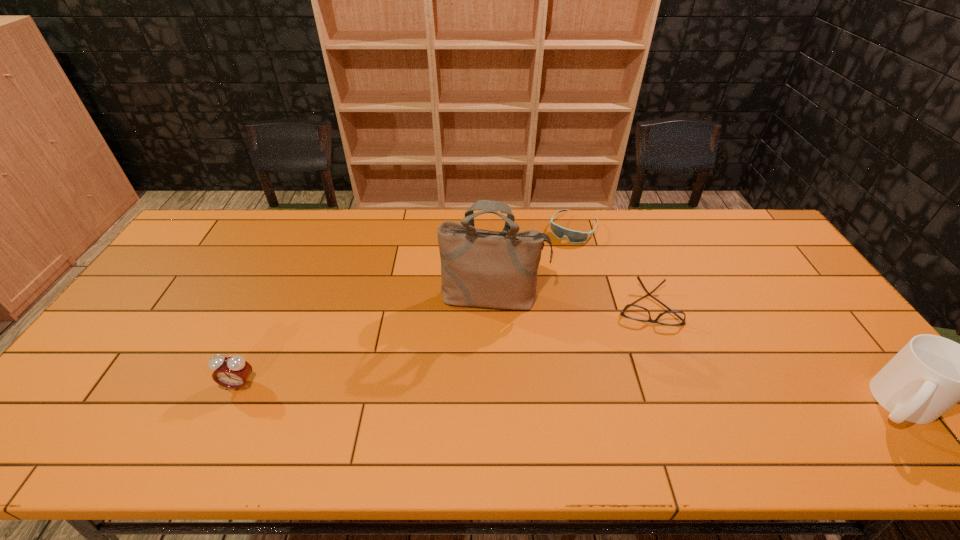
You are a GUI agent. You are given a task and a screenshot of the screen. Output one action in this format:
    pyautogui.click(x=<x>, y=<y>)
    Task: Click on the vacant space positioned on the front-facing side of the tallest object
    This screenshot has width=960, height=540.
    Given the screenshot: What is the action you would take?
    pyautogui.click(x=486, y=414)

Image resolution: width=960 pixels, height=540 pixels. I want to click on vacant region located on the front-facing side of the tallest object, so click(x=490, y=340).

You are a GUI agent. You are given a task and a screenshot of the screen. Output one action in this format:
    pyautogui.click(x=<x>, y=<y>)
    Task: Click on the vacant space located 0.070m on the front-facing side of the spectacles
    The image size is (960, 540).
    Given the screenshot: What is the action you would take?
    pyautogui.click(x=648, y=345)

Where is `free space located on the front-facing side of the spectacles`? The height and width of the screenshot is (540, 960). free space located on the front-facing side of the spectacles is located at coordinates (651, 389).

Locate an element on the screen. This screenshot has width=960, height=540. free location located on the front-facing side of the spectacles is located at coordinates (651, 386).

The image size is (960, 540). I want to click on object that is at the far edge, so click(573, 236).

You are a GUI agent. You are given a task and a screenshot of the screen. Output one action in this format:
    pyautogui.click(x=<x>, y=<y>)
    Task: Click on the object that is at the near edge
    The image size is (960, 540).
    Given the screenshot: What is the action you would take?
    pyautogui.click(x=233, y=372)

You are a GUI agent. You are given a task and a screenshot of the screen. Output one action in this format:
    pyautogui.click(x=<x>, y=<y>)
    Task: Click on the vacant space at the far edge of the desktop
    
    Given the screenshot: What is the action you would take?
    pyautogui.click(x=681, y=214)

The image size is (960, 540). I want to click on vacant space at the near edge, so click(808, 392).

Where is `free point at the left edge`? This screenshot has height=540, width=960. free point at the left edge is located at coordinates (143, 335).